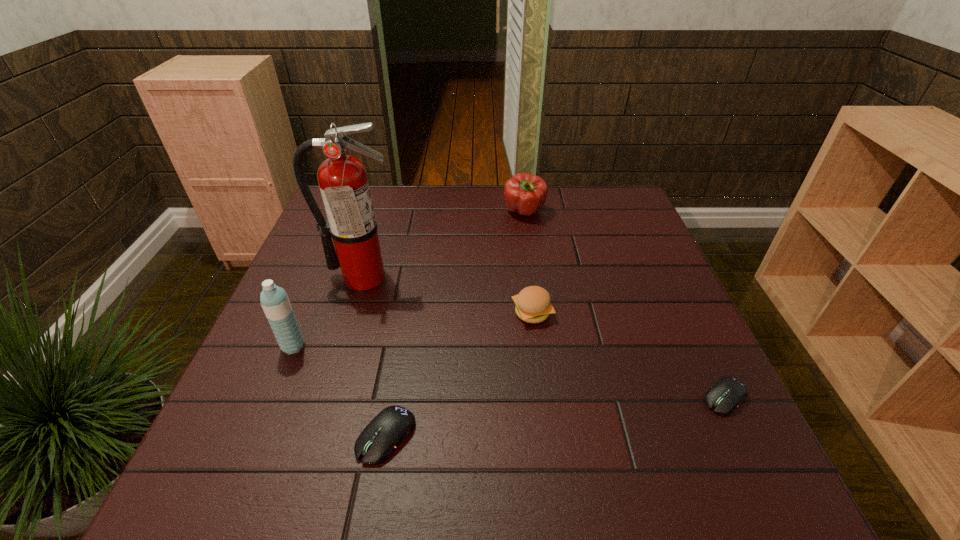
Locate an element on the screen. free space between the fifth nearest object and the water bottle is located at coordinates (328, 311).

Locate an element on the screen. The width and height of the screenshot is (960, 540). free space between the third tallest object and the water bottle is located at coordinates (409, 279).

The width and height of the screenshot is (960, 540). I want to click on free space between the fourth tallest object and the tallest object, so click(x=447, y=294).

This screenshot has height=540, width=960. I want to click on free space between the farthest object and the fourth tallest object, so click(528, 262).

This screenshot has width=960, height=540. Identify the location of empty location between the second tallest object and the tallest object. (328, 311).

You are a GUI agent. You are given a task and a screenshot of the screen. Output one action in this format:
    pyautogui.click(x=<x>, y=<y>)
    Task: Click on the vacant area that lies between the bell pepper and the water bottle
    This screenshot has width=960, height=540.
    Given the screenshot: What is the action you would take?
    pyautogui.click(x=409, y=279)

You are a GUI agent. You are given a task and a screenshot of the screen. Output one action in this format:
    pyautogui.click(x=<x>, y=<y>)
    Task: Click on the empty space between the third nearest object and the hamburger
    This screenshot has height=540, width=960.
    Given the screenshot: What is the action you would take?
    pyautogui.click(x=413, y=329)

Image resolution: width=960 pixels, height=540 pixels. I want to click on free point between the fire extinguisher and the shortest object, so click(544, 337).

You are a GUI agent. You are given a task and a screenshot of the screen. Output one action in this format:
    pyautogui.click(x=<x>, y=<y>)
    Task: Click on the free space between the shortest object and the left computer equipment
    This screenshot has width=960, height=540.
    Given the screenshot: What is the action you would take?
    pyautogui.click(x=556, y=417)

Identify the location of object that can be found as the fourth closest to the rightmost object. (343, 182).